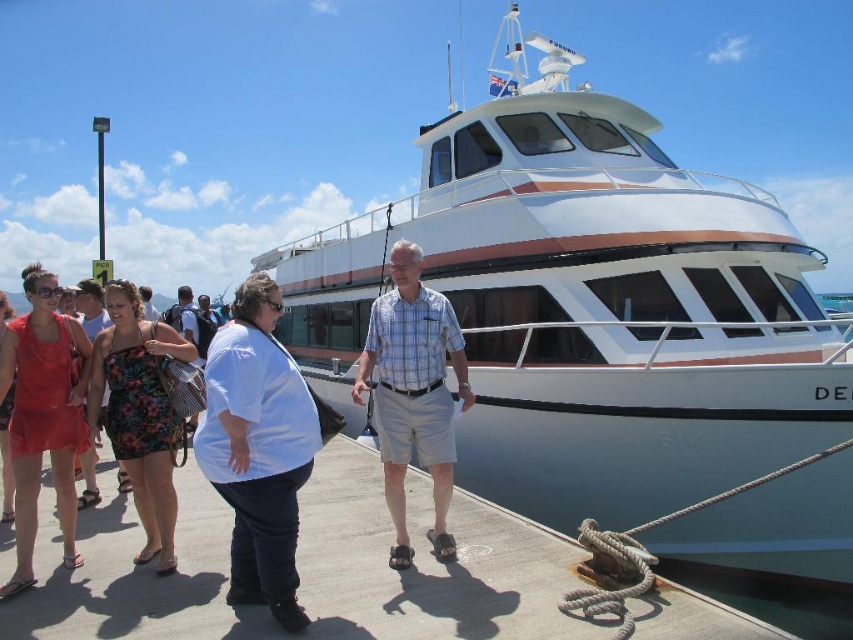
You are standing at the dock and want to reach the point marked as point (67,365). If your walking speed is 3 feet per second, how many seconds will it take you to reach that point?

The distance between the viewer and point (67,365) is 26.65 feet. At a speed of 3 feet per second, it will take approximately 8.88 seconds to reach the point.

You are standing at the dock and want to reach the point marked as point (x=396, y=321). If your walking speed is 1.2 meters per second, how many seconds will it take you to reach that point?

The point (x=396, y=321) is 8.44 meters away from the viewer. At a walking speed of 1.2 meters per second, it will take approximately 7.03 seconds to reach the point.

You are standing at point (22, 410) and want to walk to point (397, 356). Based on the scene description, will you have to walk forward or backward to reach your destination?

Since point (397, 356) is behind point (22, 410), you will have to walk backward to reach it.